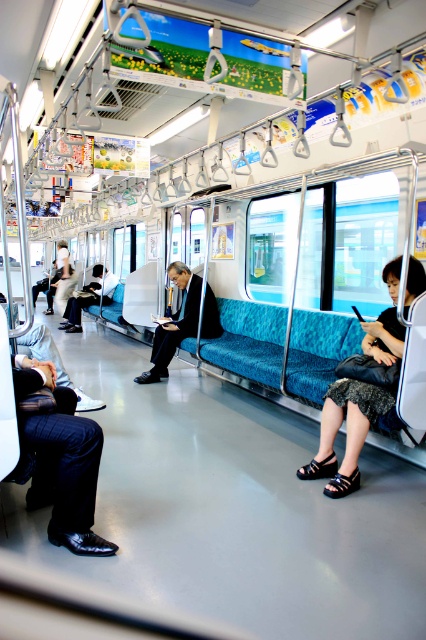
You are a passenger standing in the subway carriage and want to place a rectangular box that is 10 cm wide between the shiny black shoe at lower left and the black leather skirt at lower right. Can the box fit between them based on their widths?

The shiny black shoe at lower left is narrower than the black leather skirt at lower right. Since the box is 10 cm wide, it depends on the combined space between them. However, the description only states the shoe is narrower, not the total width between objects. Without knowing the exact distance between them, we cannot confirm if the box will fit.